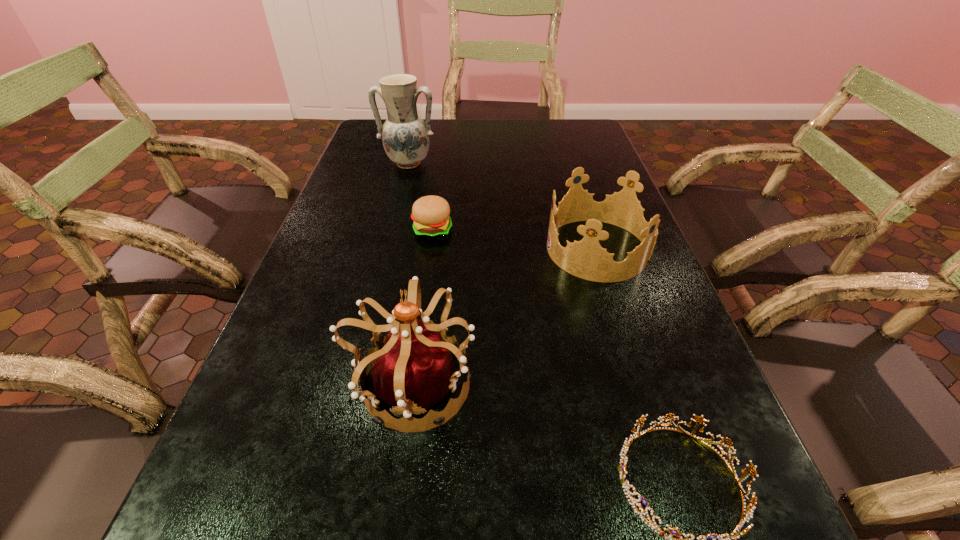
Select which object is the closest to the hamburger. Please provide its 2D coordinates. Your answer should be formatted as a tuple, i.e. [(x, y)], where the tuple contains the x and y coordinates of a point satisfying the conditions above.

[(586, 259)]

At what (x,y) coordinates should I click in order to perform the action: click on object that is the third nearest to the shortest object. Please return your answer as a coordinate pair (x, y). Looking at the image, I should click on (430, 214).

Locate an element on the screen. This screenshot has height=540, width=960. tiara that is the second nearest to the third shortest object is located at coordinates (672, 531).

The image size is (960, 540). What are the coordinates of `tiara object that ranks as the closest to the third tallest object` in the screenshot? It's located at (412, 368).

Image resolution: width=960 pixels, height=540 pixels. In order to click on vacant position in the image that satisfies the following two spatial constraints: 1. on the front side of the hamburger; 2. on the front-facing side of the leftmost tiara in this screenshot , I will do `click(412, 384)`.

Identify the location of vacant region that satisfies the following two spatial constraints: 1. on the front side of the hamburger; 2. on the front-facing side of the tallest tiara. Image resolution: width=960 pixels, height=540 pixels. (412, 384).

Locate an element on the screen. This screenshot has height=540, width=960. vacant space that satisfies the following two spatial constraints: 1. on the front side of the fourth tallest object; 2. on the front-facing side of the leftmost tiara is located at coordinates (412, 384).